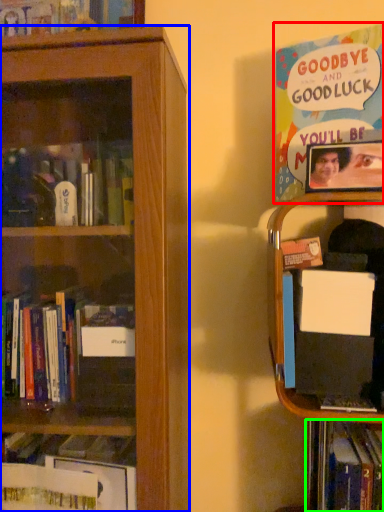
Question: Which object is the closest to the book (highlighted by a red box)? Choose among these: bookcase (highlighted by a blue box) or book (highlighted by a green box).

Choices:
 (A) bookcase
 (B) book

Answer: (A)